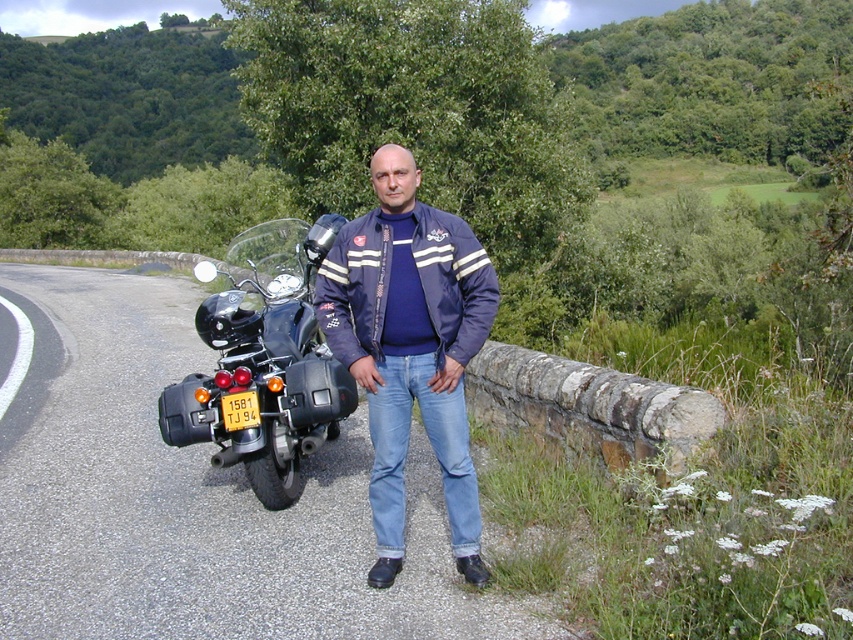
Question: Based on their relative distances, which object is nearer to the navy blue jacket at center?

Choices:
 (A) black matte motorcycle at left
 (B) asphalt road at center

Answer: (A)

Question: Estimate the real-world distances between objects in this image. Which object is closer to the asphalt road at center?

Choices:
 (A) navy blue jacket at center
 (B) black matte motorcycle at left

Answer: (B)

Question: Is navy blue jacket at center smaller than black matte motorcycle at left?

Choices:
 (A) no
 (B) yes

Answer: (B)

Question: Where is asphalt road at center located in relation to black matte motorcycle at left in the image?

Choices:
 (A) right
 (B) left

Answer: (A)

Question: Which object is farther from the camera taking this photo?

Choices:
 (A) black matte motorcycle at left
 (B) navy blue jacket at center

Answer: (A)

Question: Is asphalt road at center wider than black matte motorcycle at left?

Choices:
 (A) yes
 (B) no

Answer: (A)